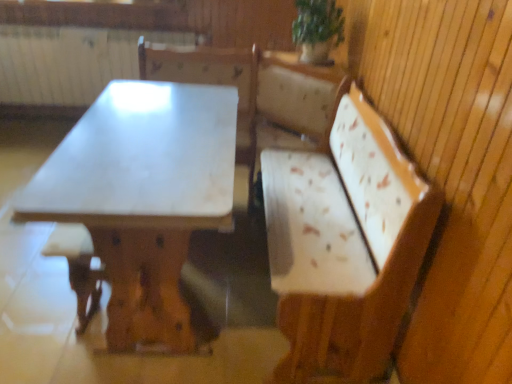
Question: Considering the positions of point (71, 258) and point (96, 122), is point (71, 258) closer or farther from the camera than point (96, 122)?

Choices:
 (A) farther
 (B) closer

Answer: (B)

Question: In terms of height, does brown wood step stool at lower left look taller or shorter compared to white marble table at center?

Choices:
 (A) tall
 (B) short

Answer: (B)

Question: Considering the real-world distances, which object is closest to the green leafy plant at upper center?

Choices:
 (A) white painted radiator at upper left
 (B) white marble table at center
 (C) brown wood step stool at lower left

Answer: (B)

Question: Which object is positioned closest to the green leafy plant at upper center?

Choices:
 (A) white painted radiator at upper left
 (B) white marble table at center
 (C) brown wood step stool at lower left

Answer: (B)